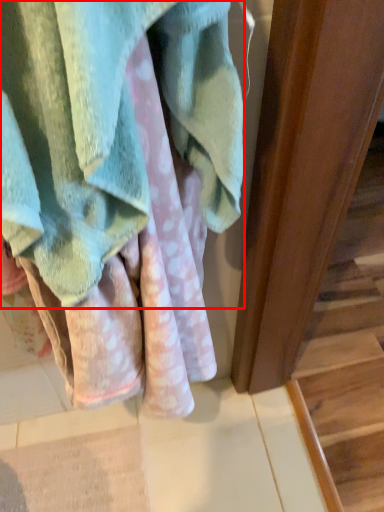
Question: From the image, what is the correct spatial relationship of towel (annotated by the red box) in relation to stairwell?

Choices:
 (A) left
 (B) right

Answer: (A)